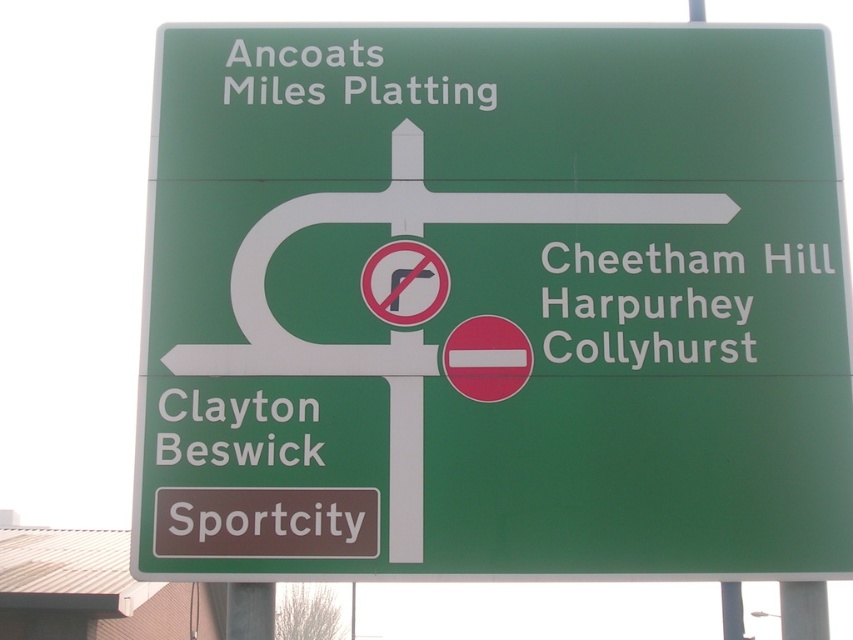
Which is more to the left, white text on green sign at right or white text on green sign at upper center?

white text on green sign at upper center is more to the left.

Is point (566, 353) positioned in front of point (349, 92)?

Yes.

Find the location of a particular element. This screenshot has height=640, width=853. white text on green sign at right is located at coordinates 646,284.

Between green matte sign at upper center and white text on green sign at upper center, which one appears on the left side from the viewer's perspective?

From the viewer's perspective, white text on green sign at upper center appears more on the left side.

Describe the element at coordinates (494, 305) in the screenshot. I see `green matte sign at upper center` at that location.

In order to click on green matte sign at upper center in this screenshot , I will do `click(494, 305)`.

Who is higher up, green matte sign at upper center or white text on green sign at right?

green matte sign at upper center is above.

In order to click on green matte sign at upper center in this screenshot , I will do `click(494, 305)`.